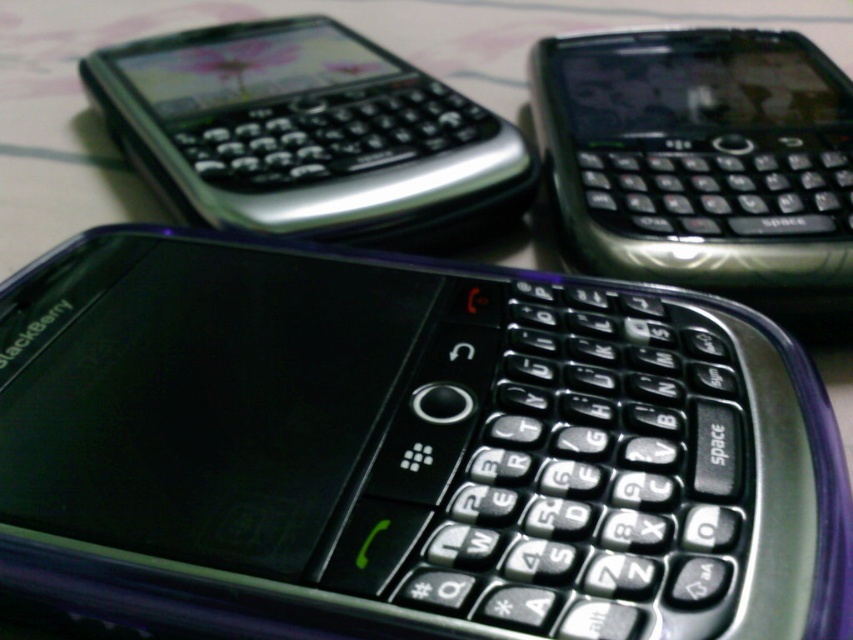
Question: Considering the relative positions of black glossy phone at upper right and satin silver phone at upper left in the image provided, where is black glossy phone at upper right located with respect to satin silver phone at upper left?

Choices:
 (A) below
 (B) above

Answer: (A)

Question: Which point is closer to the camera?

Choices:
 (A) black glossy phone at upper right
 (B) satin silver phone at upper left

Answer: (A)

Question: Is black glossy phone at upper right to the right of satin silver phone at upper left from the viewer's perspective?

Choices:
 (A) no
 (B) yes

Answer: (B)

Question: Can you confirm if black glossy phone at upper right is wider than satin silver phone at upper left?

Choices:
 (A) yes
 (B) no

Answer: (B)

Question: Which of the following is the closest to the observer?

Choices:
 (A) (566, 205)
 (B) (225, 32)

Answer: (A)

Question: Which point is farther to the camera?

Choices:
 (A) (836, 72)
 (B) (433, 96)

Answer: (A)